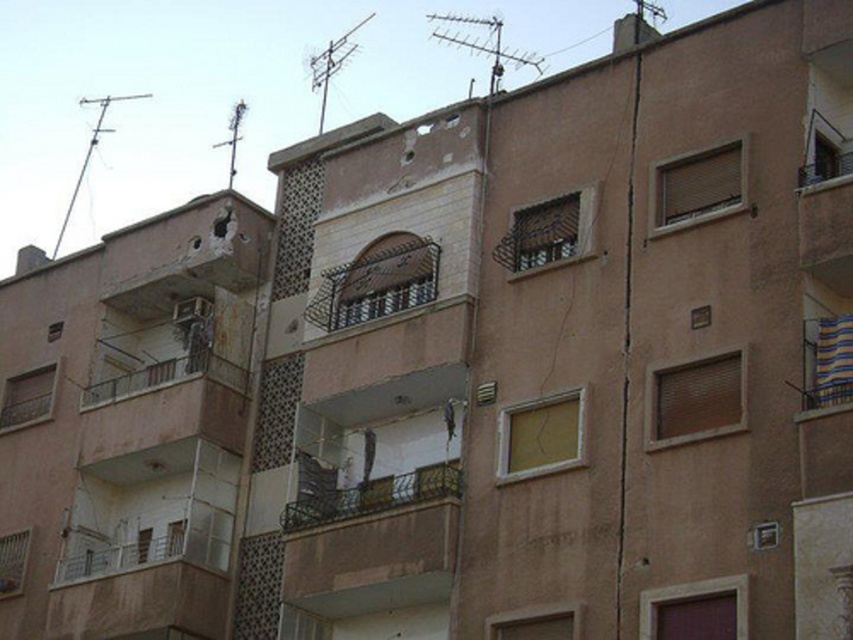
Question: Can you confirm if matte brown window at center-right is positioned above brown matte door at lower right?

Choices:
 (A) yes
 (B) no

Answer: (A)

Question: Does matte brown window at lower left have a larger size compared to matte white window at lower left?

Choices:
 (A) yes
 (B) no

Answer: (B)

Question: Which point is farther to the camera?

Choices:
 (A) matte white window at lower center
 (B) metallic mesh window at upper center
 (C) metallic balcony at lower left

Answer: (C)

Question: Is white metal balcony at lower left smaller than metallic balcony at lower left?

Choices:
 (A) yes
 (B) no

Answer: (B)

Question: Which object is positioned closest to the matte brown window at lower left?

Choices:
 (A) metallic brown balcony at center
 (B) matte brown window at center-right
 (C) matte white window at lower left

Answer: (C)

Question: Which point is closer to the camera?

Choices:
 (A) wooden lattice window at center
 (B) brown matte door at lower right

Answer: (B)